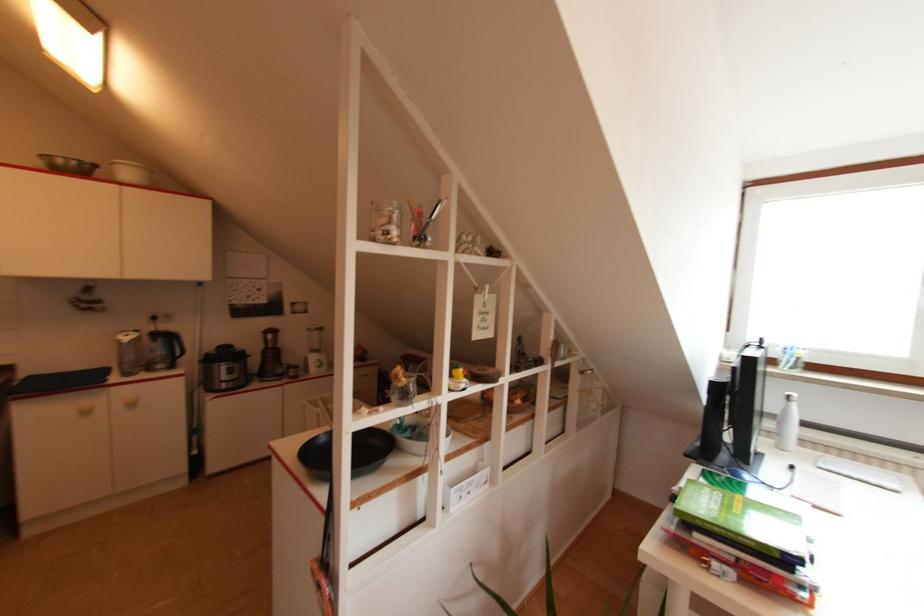
Find where to lift the black wok. Please return your answer as a coordinate pair (x, y).

(346, 453)